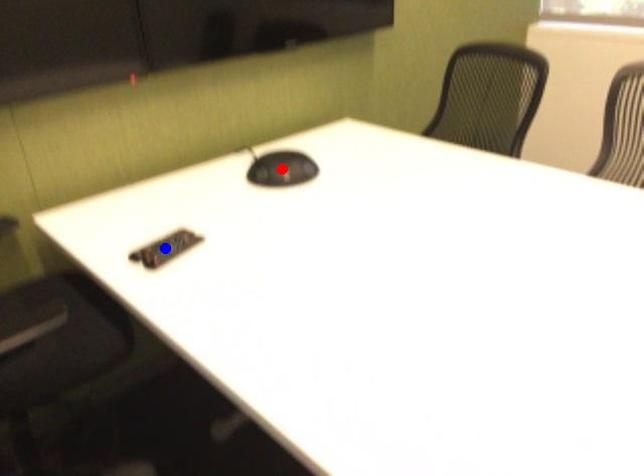
Question: Which of the two points in the image is closer to the camera?

Choices:
 (A) Blue point is closer.
 (B) Red point is closer.

Answer: (A)